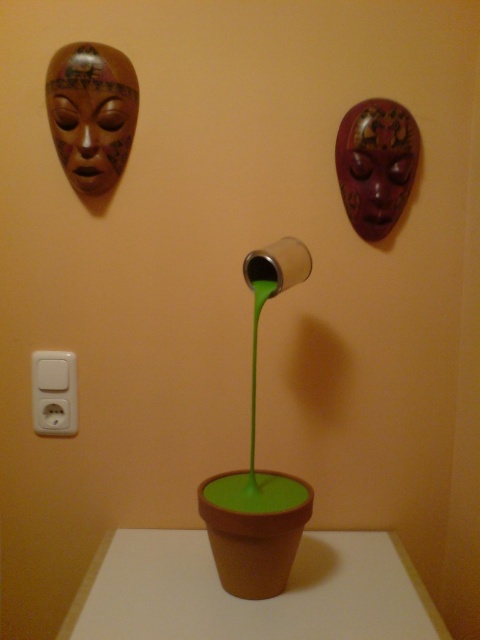
Question: Observing the image, what is the correct spatial positioning of matte brown mask at upper left in reference to white plastic electric outlet at lower left?

Choices:
 (A) right
 (B) left

Answer: (A)

Question: Can you confirm if matte brown mask at upper right is positioned to the left of white plastic electric outlet at lower left?

Choices:
 (A) yes
 (B) no

Answer: (B)

Question: Which point is farther to the camera?

Choices:
 (A) pos(383,202)
 (B) pos(48,406)
 (C) pos(76,93)

Answer: (B)

Question: Can you confirm if matte brown mask at upper left is positioned above matte brown mask at upper right?

Choices:
 (A) no
 (B) yes

Answer: (B)

Question: Which point is closer to the camera?

Choices:
 (A) matte brown mask at upper left
 (B) white plastic electric outlet at lower left
 (C) matte brown mask at upper right

Answer: (A)

Question: Which is nearer to the matte brown mask at upper left?

Choices:
 (A) matte brown mask at upper right
 (B) white plastic electric outlet at lower left

Answer: (B)